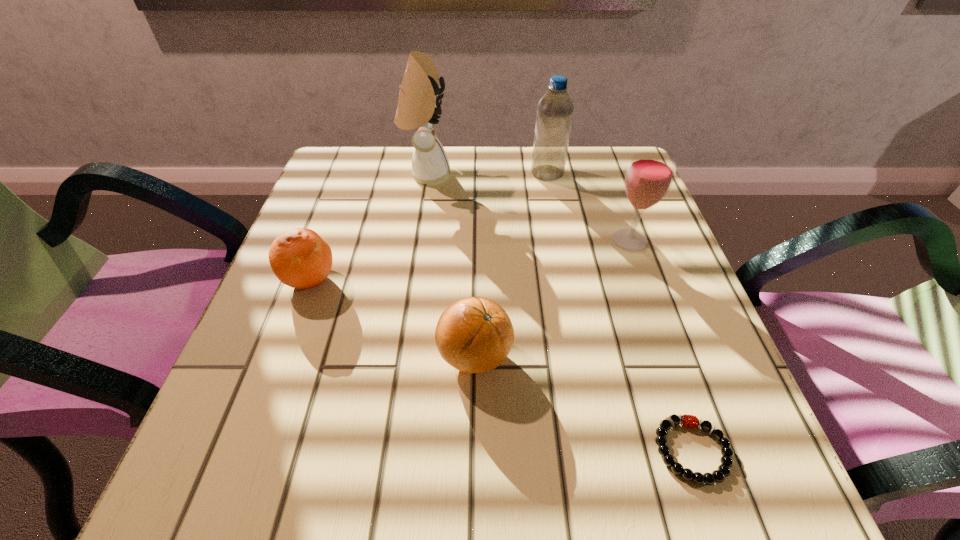
This screenshot has height=540, width=960. I want to click on bracelet, so click(689, 421).

The image size is (960, 540). Find the location of `the shortest object`. the shortest object is located at coordinates (689, 421).

Find the location of a particular element. Image resolution: width=960 pixels, height=540 pixels. vacant space located 0.230m at the front face of the second object from left to right is located at coordinates (546, 174).

Find the location of a particular element. vacant region located 0.380m on the left of the fourth object from left to right is located at coordinates (373, 173).

At what (x,y) coordinates should I click in order to perform the action: click on free spot located 0.310m on the front of the third farthest object. Please return your answer as a coordinate pair (x, y). The height and width of the screenshot is (540, 960). Looking at the image, I should click on (685, 396).

Find the location of a particular element. vacant space located on the left of the fifth farthest object is located at coordinates (369, 356).

Identify the location of vacant space located on the right of the fourth farthest object. tap(397, 280).

Image resolution: width=960 pixels, height=540 pixels. I want to click on vacant space positioned on the left of the nearest object, so [x=389, y=450].

Identify the location of doll at the far edge. This screenshot has width=960, height=540. (418, 107).

Where is `water bottle located in the far edge section of the desktop`? water bottle located in the far edge section of the desktop is located at coordinates (555, 109).